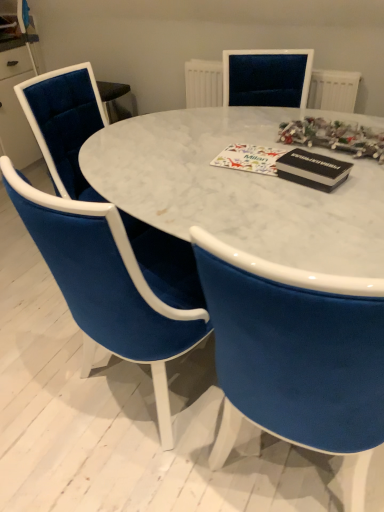
The image size is (384, 512). In order to click on space that is in front of black matte magazine at upper right in this screenshot , I will do `click(319, 203)`.